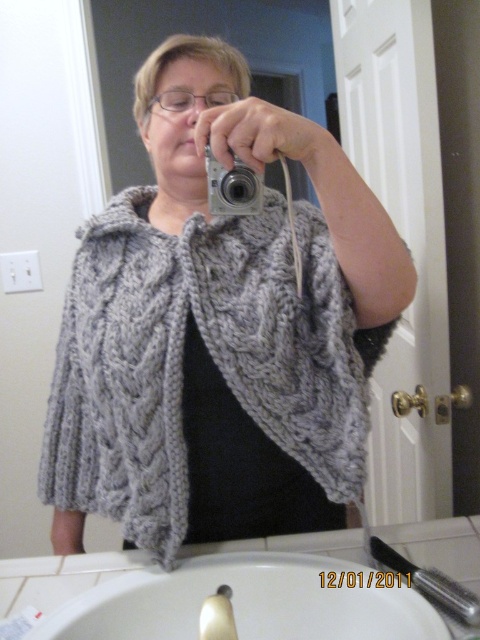
Can you confirm if gray knitted scarf at center is taller than silver metallic camera at center?

Yes.

The width and height of the screenshot is (480, 640). Find the location of `gray knitted scarf at center`. gray knitted scarf at center is located at coordinates (205, 356).

Is point (214, 328) positioned after point (178, 621)?

Yes.

Which is below, gray knitted scarf at center or white ceramic sink at lower center?

Positioned lower is white ceramic sink at lower center.

Is point (338, 362) farther from viewer compared to point (301, 605)?

Yes, point (338, 362) is farther from viewer.

Identify the location of gray knitted scarf at center. This screenshot has width=480, height=640. (205, 356).

Does white ceramic sink at lower center have a smaller size compared to silver metallic camera at center?

No, white ceramic sink at lower center is not smaller than silver metallic camera at center.

Does point (264, 620) lie behind point (219, 211)?

Yes.

Locate an element on the screen. white ceramic sink at lower center is located at coordinates (249, 602).